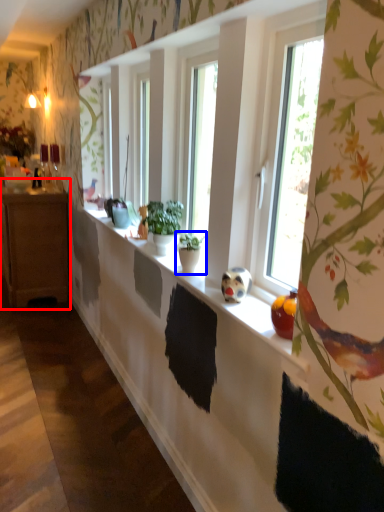
Question: Among these objects, which one is farthest to the camera, cabinetry (highlighted by a red box) or houseplant (highlighted by a blue box)?

Choices:
 (A) cabinetry
 (B) houseplant

Answer: (A)